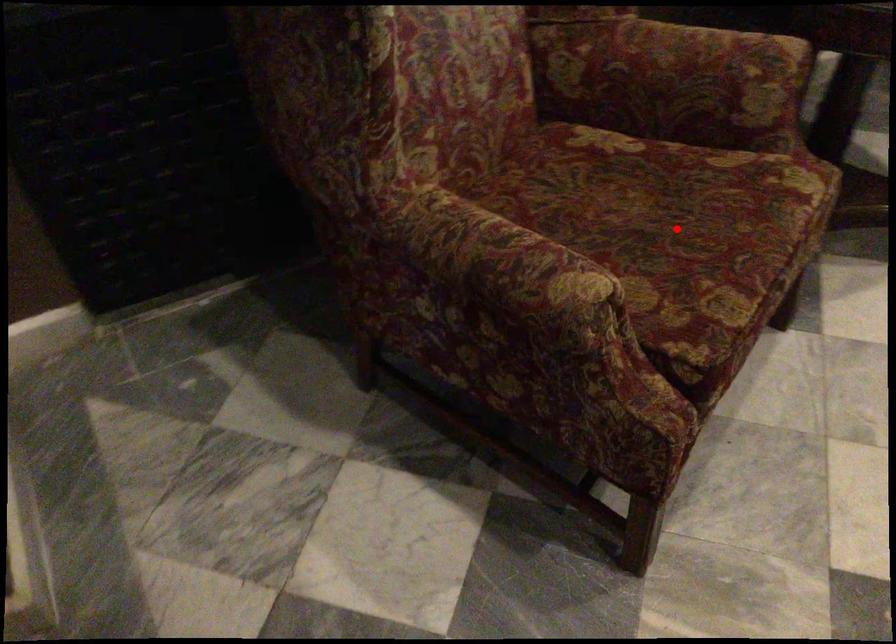
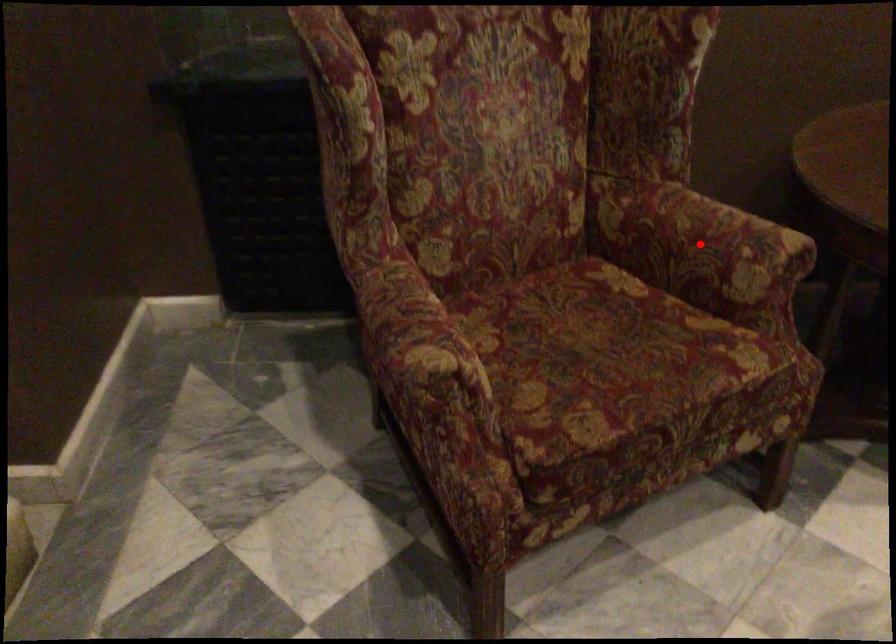
I am providing you with two images of the same scene from different viewpoints. A red point is marked on the first image and another point is marked on the second image. Do the highlighted points in image1 and image2 indicate the same real-world spot?

No